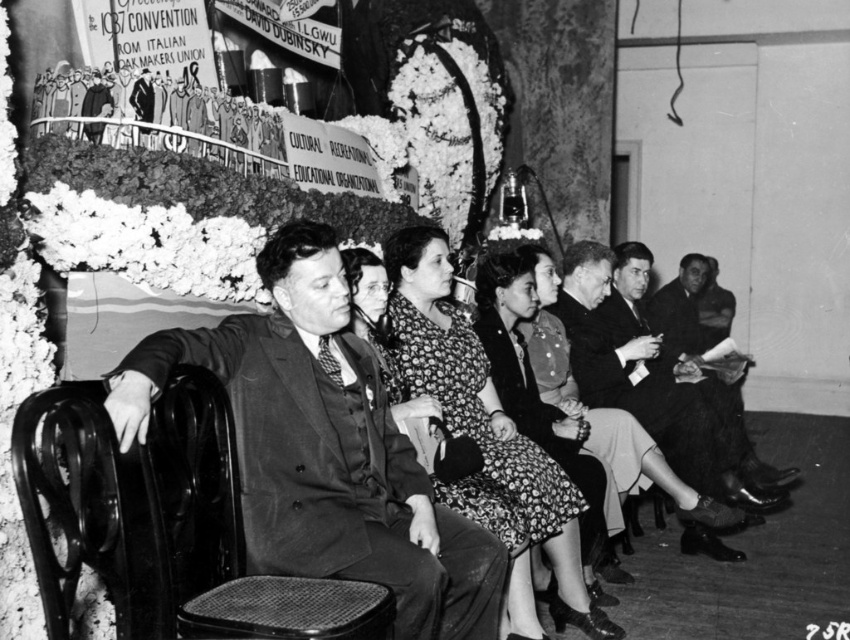
Question: Which object appears farthest from the camera in this image?

Choices:
 (A) smooth black suit at center
 (B) floral-patterned dress at center
 (C) black metal chair at center
 (D) woven fabric chair at center

Answer: (B)

Question: Which of the following is the farthest from the observer?

Choices:
 (A) (48, 554)
 (B) (480, 484)
 (C) (210, 604)
 (D) (409, 497)

Answer: (B)

Question: Is floral-patterned dress at center bigger than smooth leather jacket at center?

Choices:
 (A) yes
 (B) no

Answer: (B)

Question: Can you confirm if floral-patterned dress at center is wider than black metal chair at center?

Choices:
 (A) yes
 (B) no

Answer: (A)

Question: Is floral-patterned dress at center thinner than woven fabric chair at center?

Choices:
 (A) yes
 (B) no

Answer: (B)

Question: Which of these objects is positioned closest to the floral-patterned dress at center?

Choices:
 (A) black metal chair at center
 (B) woven fabric chair at center

Answer: (B)